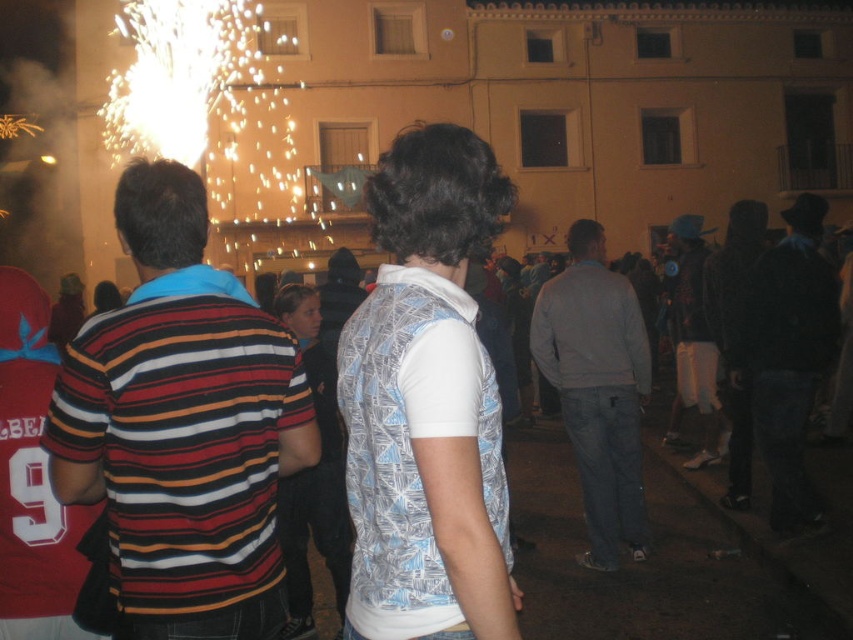
Who is lower down, striped cotton shirt at left or dark blue jeans at lower right?

striped cotton shirt at left is lower down.

Does striped cotton shirt at left appear on the right side of dark blue jeans at lower right?

No, striped cotton shirt at left is not to the right of dark blue jeans at lower right.

Does point (228, 292) lie in front of point (787, 436)?

Yes, point (228, 292) is closer to viewer.

Find the location of a particular element. The height and width of the screenshot is (640, 853). striped cotton shirt at left is located at coordinates click(x=183, y=426).

Identify the location of striped cotton shirt at left. (183, 426).

Is point (209, 349) less distant than point (637, 432)?

Yes.

Where is `striped cotton shirt at left`? striped cotton shirt at left is located at coordinates (183, 426).

Does striped cotton shirt at left have a larger size compared to white cotton shirt at center?

Incorrect, striped cotton shirt at left is not larger than white cotton shirt at center.

Can you confirm if striped cotton shirt at left is thinner than white cotton shirt at center?

Yes, striped cotton shirt at left is thinner than white cotton shirt at center.

Image resolution: width=853 pixels, height=640 pixels. Describe the element at coordinates (183, 426) in the screenshot. I see `striped cotton shirt at left` at that location.

The width and height of the screenshot is (853, 640). What are the coordinates of `striped cotton shirt at left` in the screenshot? It's located at (183, 426).